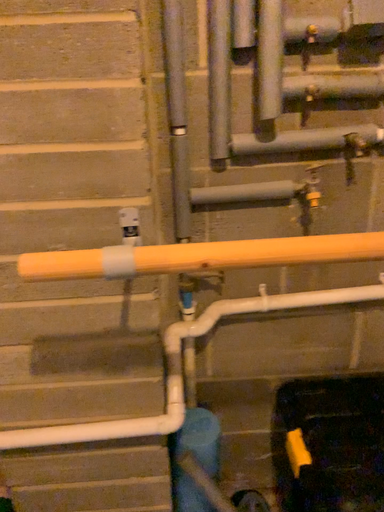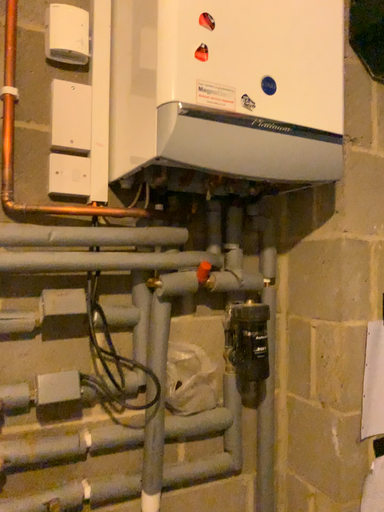
Question: Which way did the camera rotate in the video?

Choices:
 (A) rotated downward
 (B) rotated upward

Answer: (B)